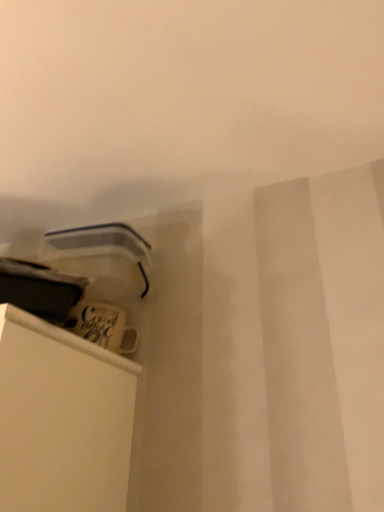
The width and height of the screenshot is (384, 512). Describe the element at coordinates (66, 338) in the screenshot. I see `white plastic container at lower left` at that location.

Find the location of a particular element. white plastic container at lower left is located at coordinates (66, 338).

Locate an element on the screen. The image size is (384, 512). white plastic container at lower left is located at coordinates (66, 338).